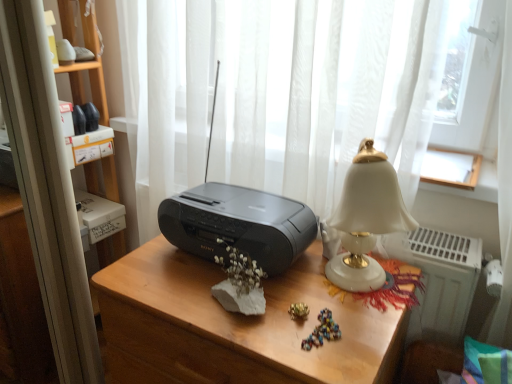
Locate an element on the screen. This screenshot has height=384, width=512. free space in front of black plastic stereo at center is located at coordinates (248, 319).